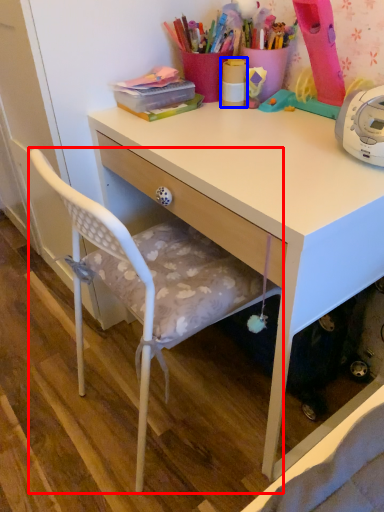
Question: Which point is further to the camera, chair (highlighted by a red box) or office supplies (highlighted by a blue box)?

Choices:
 (A) chair
 (B) office supplies

Answer: (B)